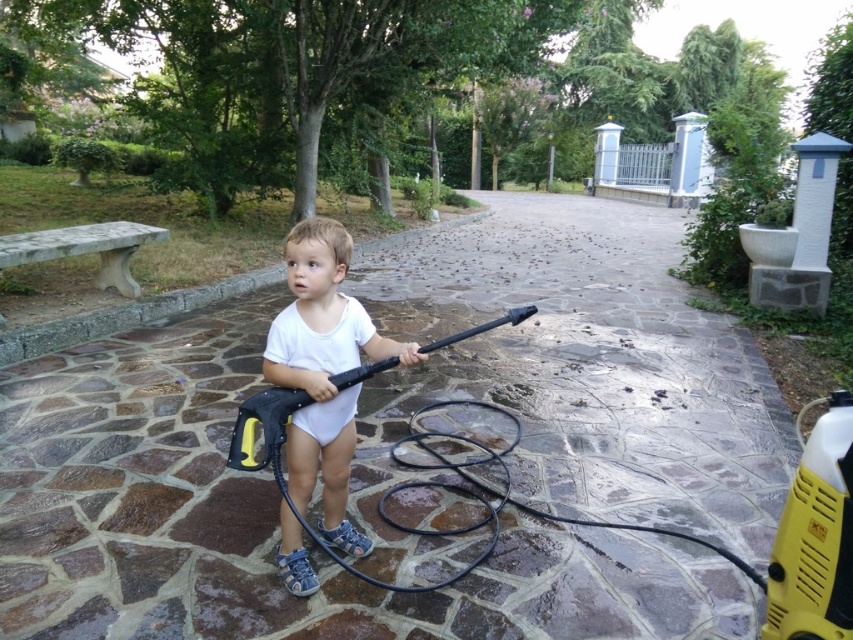
You are a landscape architect designing a garden path. You need to place a decorative stone on the brown stone pavement at center. Considering the white matte onesie at center is also present, which object has enough space to accommodate the stone?

The white matte onesie at center has enough space to accommodate the stone because the brown stone pavement at center has a lesser width compared to white matte onesie at center.

You are a photographer trying to capture the child in the white matte onesie at center while ensuring the brown stone pavement at center is visible in the frame. Based on their positions, which side of the child should you position yourself to include both subjects?

The brown stone pavement at center is to the right of the white matte onesie at center, so positioning yourself to the left of the child will allow you to include both the child and the pavement in the frame.

You are a drone operator trying to capture a photo of the child holding the pressure washer. You need to ensure that both points, point(554, 323) and point(350, 531), are visible in the photo. Which point is closer to the camera so that it appears larger in the photo?

Point(554, 323) is further to the viewer than point(350, 531), so point(350, 531) will appear larger in the photo because it is closer to the camera.